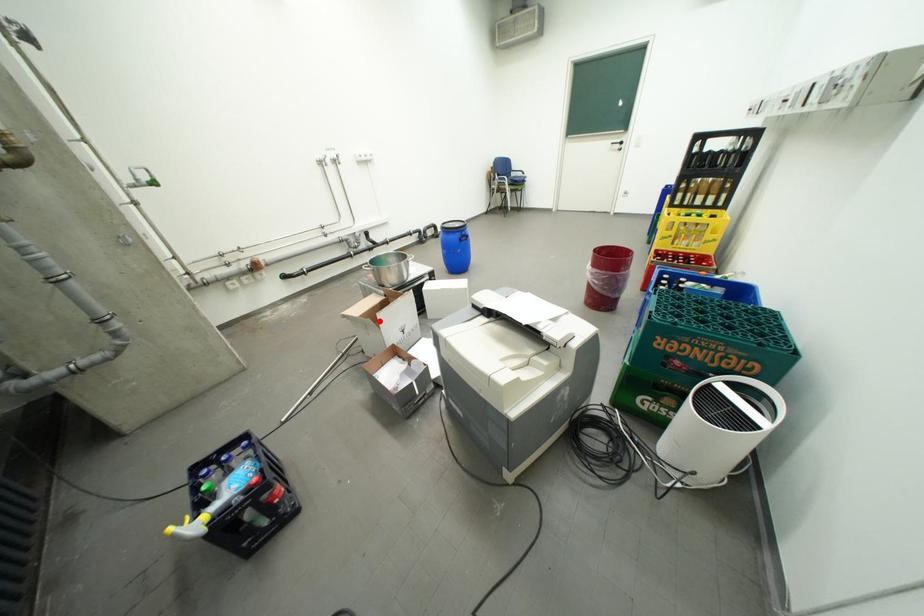
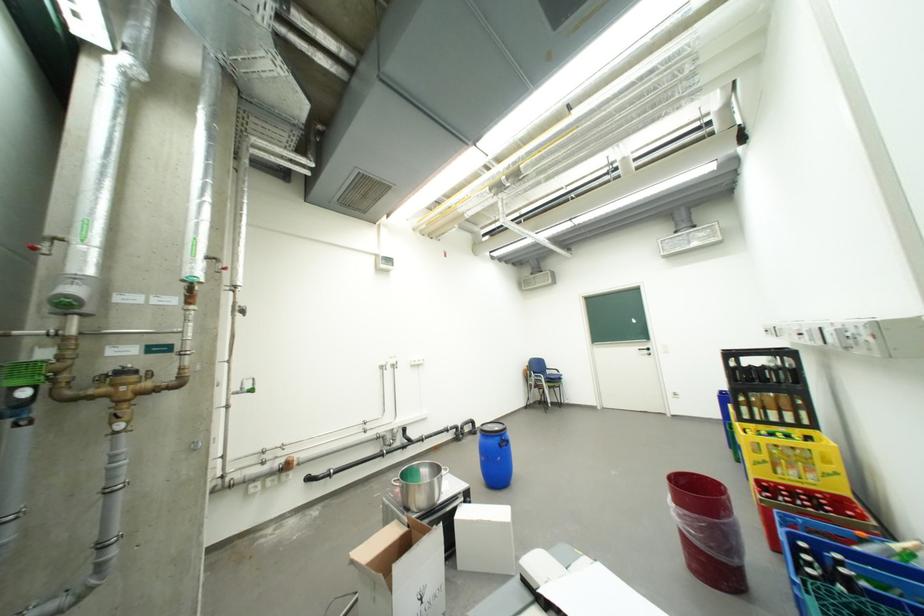
In the second image, find the point that corresponds to the highlighted location in the first image.

(392, 577)